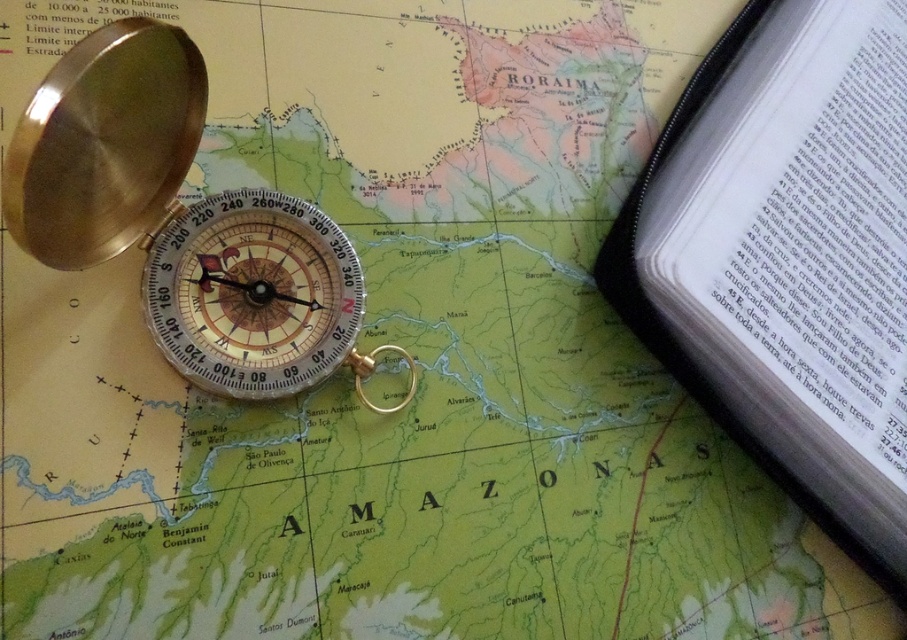
Question: Which point appears closest to the camera in this image?

Choices:
 (A) (660, 317)
 (B) (67, 232)

Answer: (B)

Question: Which point is farther to the camera?

Choices:
 (A) gold polished compass at upper left
 (B) white paper book at lower right

Answer: (B)

Question: Is white paper book at lower right to the left of gold polished compass at upper left from the viewer's perspective?

Choices:
 (A) no
 (B) yes

Answer: (A)

Question: Can you confirm if white paper book at lower right is positioned below gold polished compass at upper left?

Choices:
 (A) yes
 (B) no

Answer: (A)

Question: Which point is farther to the camera?

Choices:
 (A) white paper book at lower right
 (B) gold polished compass at upper left

Answer: (A)

Question: Is white paper book at lower right to the right of gold polished compass at upper left from the viewer's perspective?

Choices:
 (A) yes
 (B) no

Answer: (A)